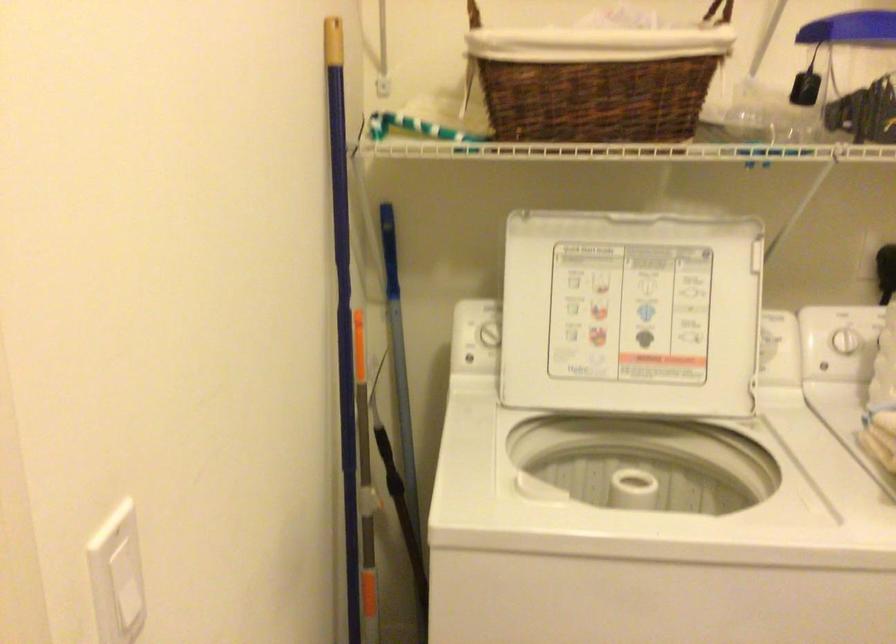
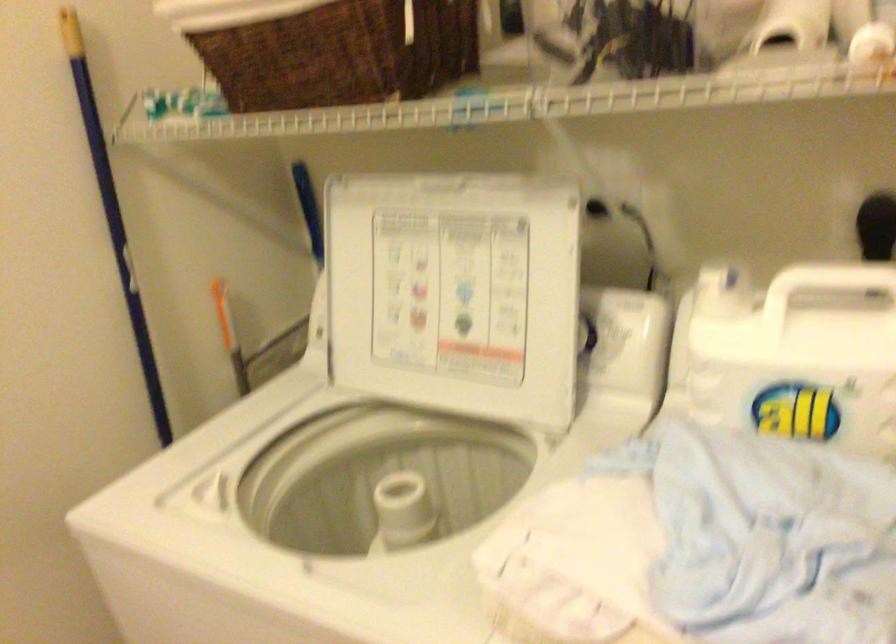
In the second image, find the point that corresponds to pixel 770 330 in the first image.

(616, 325)